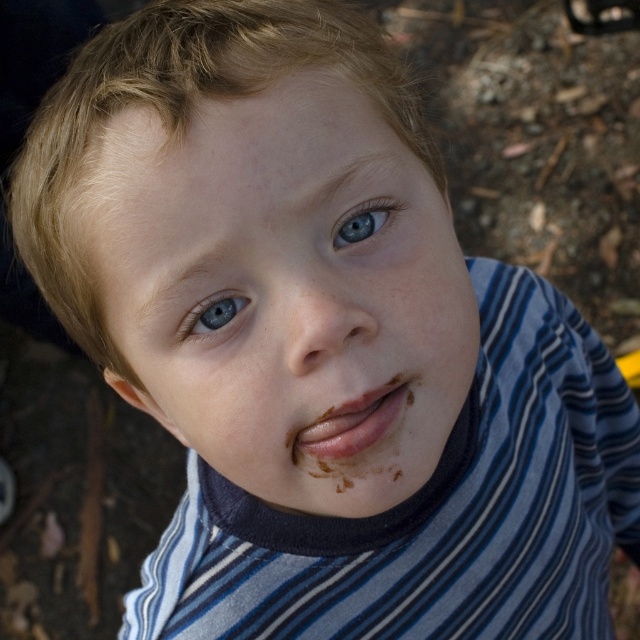
Consider the image. You are a photographer who wants to focus on the matte chocolate lips at center and the blue matte eye at upper center in the image. Which object should you adjust your camera focus to first to ensure both are in focus?

The matte chocolate lips at center should be focused on first since it is in front of the blue matte eye at upper center. By focusing on the closer object, the depth of field may allow the background object to still be somewhat in focus.

Based on the scene description, if you were to draw a circle around both the smooth skin face at center and the matte chocolate lips at center, which one would require a larger circle?

→ The smooth skin face at center requires a larger circle because it is bigger than the matte chocolate lips at center.